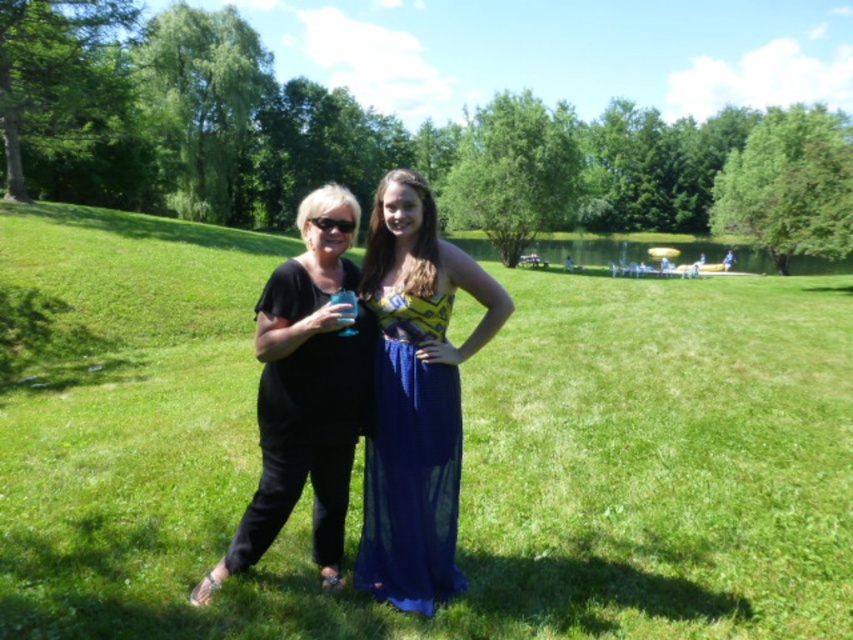
Which is below, black matte dress at center or blue chiffon dress at center?

blue chiffon dress at center is lower down.

Who is more distant from viewer, [258,401] or [432,442]?

Point [258,401]

Locate an element on the screen. The width and height of the screenshot is (853, 640). black matte dress at center is located at coordinates (306, 390).

Which of these two, green grassy field at center or blue chiffon dress at center, stands taller?

With more height is green grassy field at center.

Is point (215, 262) closer to camera compared to point (368, 440)?

No, it is not.

Find the location of a particular element. Image resolution: width=853 pixels, height=640 pixels. green grassy field at center is located at coordinates (463, 452).

Is point (338, 536) positioned after point (804, 262)?

No, (338, 536) is closer to viewer.

Between black matte dress at center and green grassy lake at center, which one has more height?

green grassy lake at center is taller.

Is point (253, 525) behind point (606, 248)?

No, (253, 525) is closer to viewer.

This screenshot has width=853, height=640. What are the coordinates of `black matte dress at center` in the screenshot? It's located at (306, 390).